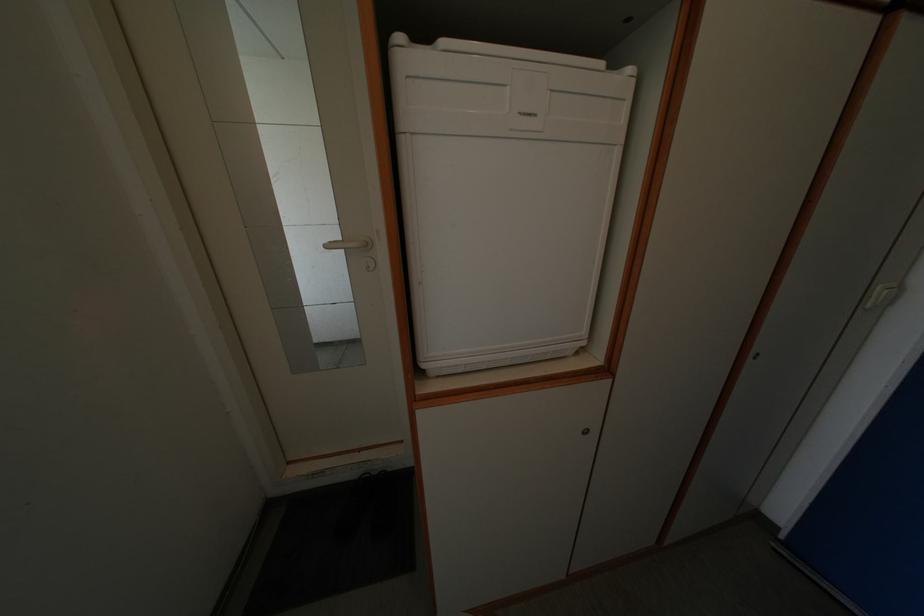
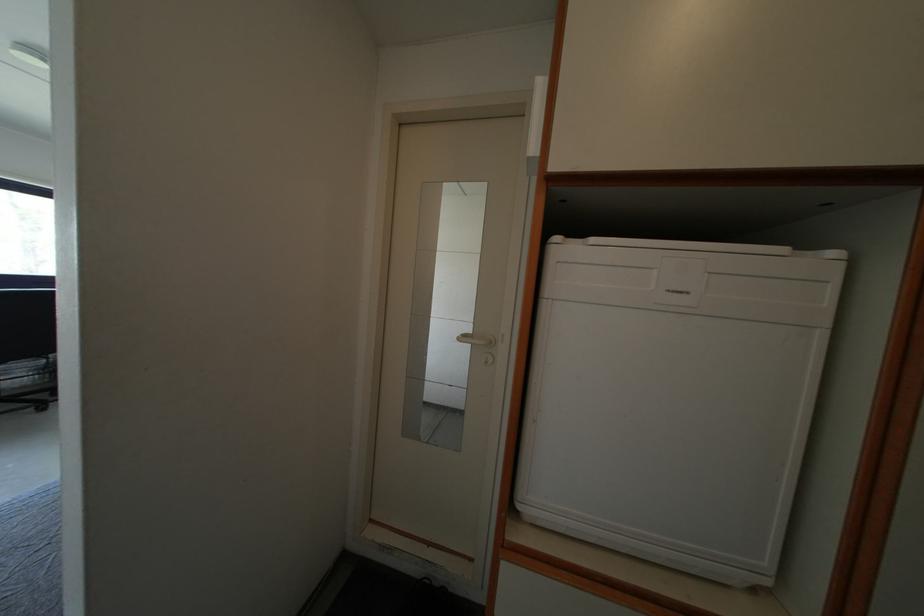
Question: The camera is either moving clockwise (left) or counter-clockwise (right) around the object. The first image is from the beginning of the video and the second image is from the end. Is the camera moving left or right when shooting the video?

Choices:
 (A) Left
 (B) Right

Answer: (B)